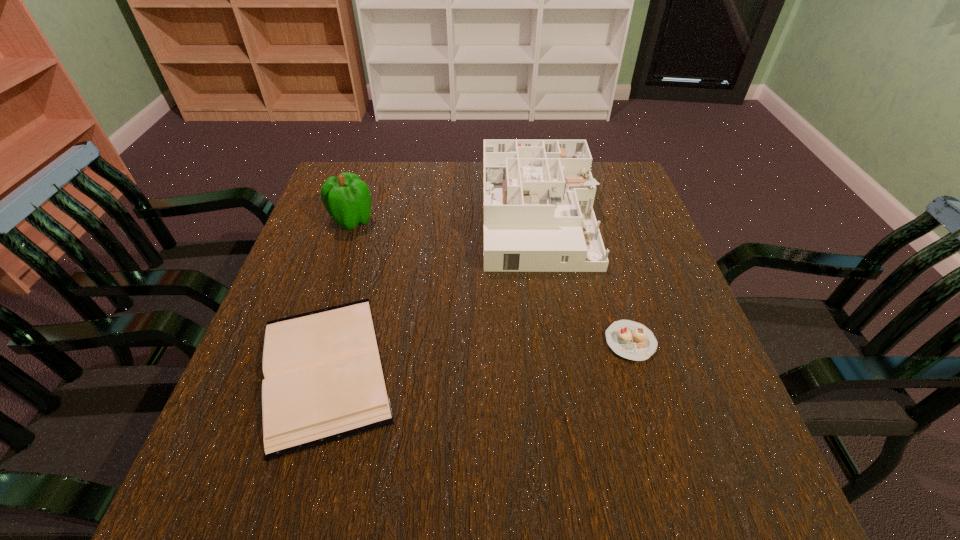
This screenshot has width=960, height=540. I want to click on vacant point located between the second shortest object and the hardback book, so click(478, 355).

Find the location of a particular element. vacant area between the second shortest object and the dollhouse is located at coordinates (585, 280).

Locate an element on the screen. The height and width of the screenshot is (540, 960). free space between the hardback book and the third tallest object is located at coordinates (478, 355).

The image size is (960, 540). I want to click on vacant space that's between the hardback book and the third tallest object, so click(478, 355).

Locate which object ranks third in proximity to the cupcake. Please provide its 2D coordinates. Your answer should be formatted as a tuple, i.e. [(x, y)], where the tuple contains the x and y coordinates of a point satisfying the conditions above.

[(347, 198)]

The image size is (960, 540). I want to click on object that is the second closest to the bell pepper, so click(x=538, y=195).

Locate an element on the screen. This screenshot has height=540, width=960. vacant area that satisfies the following two spatial constraints: 1. on the back side of the shortest object; 2. on the right side of the second shortest object is located at coordinates (332, 342).

In order to click on free space that satisfies the following two spatial constraints: 1. on the front side of the cupcake; 2. on the right side of the dollhouse in this screenshot , I will do `click(558, 342)`.